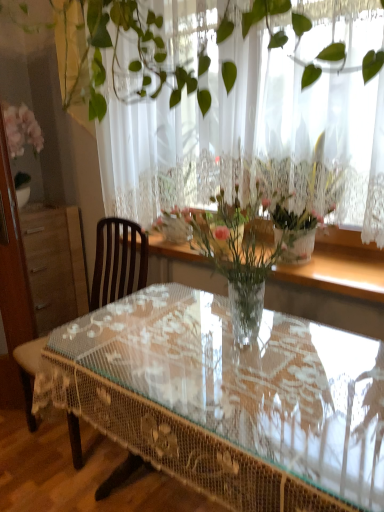
Question: Would you say brown wooden chair at left is outside white lace curtain at upper center?

Choices:
 (A) no
 (B) yes

Answer: (B)

Question: From the image's perspective, is brown wooden chair at left under white lace curtain at upper center?

Choices:
 (A) no
 (B) yes

Answer: (B)

Question: Is white lace curtain at upper center completely or partially inside brown wooden chair at left?

Choices:
 (A) no
 (B) yes

Answer: (A)

Question: From a real-world perspective, is brown wooden chair at left physically below white lace curtain at upper center?

Choices:
 (A) yes
 (B) no

Answer: (A)

Question: Is brown wooden chair at left in front of white lace curtain at upper center?

Choices:
 (A) no
 (B) yes

Answer: (A)

Question: Is clear glass vase at center taller or shorter than white lace curtain at upper center?

Choices:
 (A) tall
 (B) short

Answer: (B)

Question: Looking at the image, does clear glass vase at center seem bigger or smaller compared to white lace curtain at upper center?

Choices:
 (A) big
 (B) small

Answer: (B)

Question: Is clear glass vase at center in front of or behind white lace curtain at upper center in the image?

Choices:
 (A) behind
 (B) front

Answer: (B)

Question: Is clear glass vase at center to the left or to the right of white lace curtain at upper center in the image?

Choices:
 (A) left
 (B) right

Answer: (B)

Question: Looking at their shapes, would you say clear glass table at center is wider or thinner than clear glass vase at center?

Choices:
 (A) wide
 (B) thin

Answer: (A)

Question: From a real-world perspective, is clear glass table at center positioned above or below clear glass vase at center?

Choices:
 (A) below
 (B) above

Answer: (A)

Question: From the image's perspective, is clear glass table at center above or below clear glass vase at center?

Choices:
 (A) below
 (B) above

Answer: (A)

Question: From their relative heights in the image, would you say clear glass table at center is taller or shorter than clear glass vase at center?

Choices:
 (A) tall
 (B) short

Answer: (A)

Question: Is point (271, 474) positioned closer to the camera than point (137, 279)?

Choices:
 (A) closer
 (B) farther

Answer: (A)

Question: From the image's perspective, is clear glass table at center above or below brown wooden chair at left?

Choices:
 (A) above
 (B) below

Answer: (B)